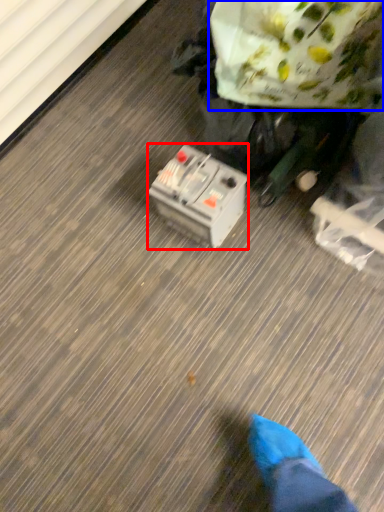
Question: Which object is closer to the camera taking this photo, equipment (highlighted by a red box) or paper bag (highlighted by a blue box)?

Choices:
 (A) equipment
 (B) paper bag

Answer: (B)